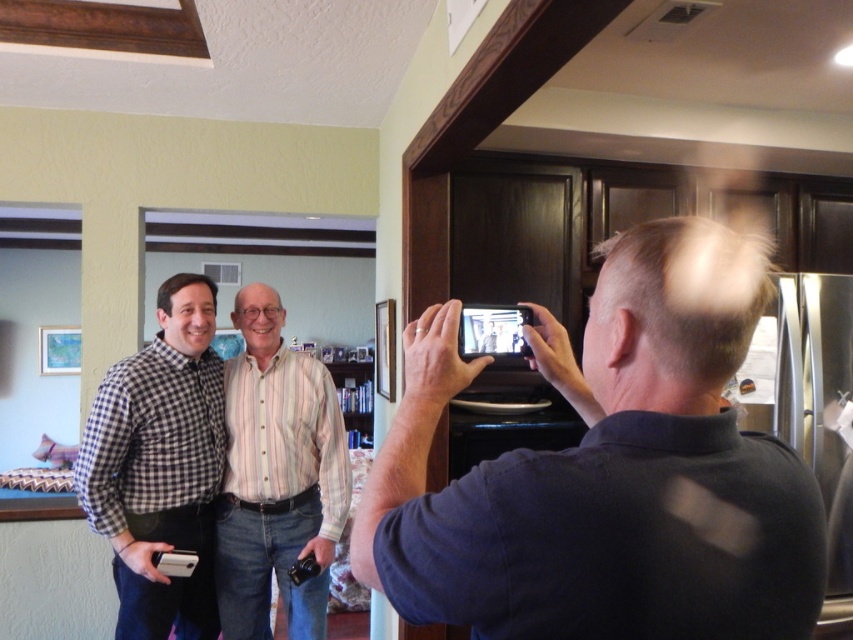
Which is behind, point (612, 285) or point (230, 634)?

The point (230, 634) is more distant.

What do you see at coordinates (608, 470) in the screenshot?
I see `matte black phone at center` at bounding box center [608, 470].

The image size is (853, 640). I want to click on matte black phone at center, so click(608, 470).

Can you confirm if checkered fabric shirt at left is positioned above striped cotton shirt at center?

Indeed, checkered fabric shirt at left is positioned over striped cotton shirt at center.

Between point (166, 445) and point (271, 420), which one is positioned in front?

Point (166, 445)

Which is in front, point (80, 454) or point (271, 499)?

Point (80, 454) is more forward.

You are a GUI agent. You are given a task and a screenshot of the screen. Output one action in this format:
    pyautogui.click(x=<x>, y=<y>)
    Task: Click on the checkered fabric shirt at left
    Image resolution: width=853 pixels, height=640 pixels.
    Given the screenshot: What is the action you would take?
    pyautogui.click(x=160, y=465)

Does matte black phone at center appear on the left side of checkered fabric shirt at left?

Incorrect, matte black phone at center is not on the left side of checkered fabric shirt at left.

Who is positioned more to the right, matte black phone at center or checkered fabric shirt at left?

matte black phone at center

Find the location of a particular element. The image size is (853, 640). matte black phone at center is located at coordinates (608, 470).